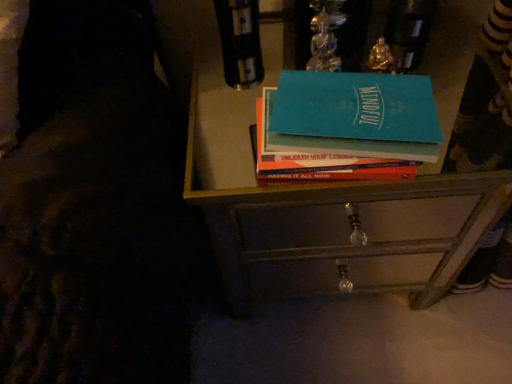
Question: Considering the relative sizes of teal matte book at center and metallic drawer at center in the image provided, is teal matte book at center shorter than metallic drawer at center?

Choices:
 (A) yes
 (B) no

Answer: (B)

Question: From the image's perspective, is teal matte book at center under metallic drawer at center?

Choices:
 (A) no
 (B) yes

Answer: (A)

Question: Is teal matte book at center not inside metallic drawer at center?

Choices:
 (A) no
 (B) yes

Answer: (B)

Question: From a real-world perspective, is teal matte book at center positioned under metallic drawer at center based on gravity?

Choices:
 (A) no
 (B) yes

Answer: (A)

Question: Does teal matte book at center appear on the left side of metallic drawer at center?

Choices:
 (A) yes
 (B) no

Answer: (A)

Question: Is teal matte book at center oriented away from metallic drawer at center?

Choices:
 (A) no
 (B) yes

Answer: (A)

Question: Can you confirm if metallic drawer at center is taller than metallic drawer at center?

Choices:
 (A) no
 (B) yes

Answer: (B)

Question: Is the position of metallic drawer at center less distant than that of metallic drawer at center?

Choices:
 (A) yes
 (B) no

Answer: (A)

Question: Is metallic drawer at center inside metallic drawer at center?

Choices:
 (A) yes
 (B) no

Answer: (A)

Question: Is metallic drawer at center behind metallic drawer at center?

Choices:
 (A) no
 (B) yes

Answer: (A)

Question: From a real-world perspective, is metallic drawer at center below metallic drawer at center?

Choices:
 (A) yes
 (B) no

Answer: (B)

Question: Would you say metallic drawer at center is a long distance from metallic drawer at center?

Choices:
 (A) yes
 (B) no

Answer: (B)

Question: Would you say metallic drawer at center is a long distance from teal matte book at center?

Choices:
 (A) yes
 (B) no

Answer: (B)